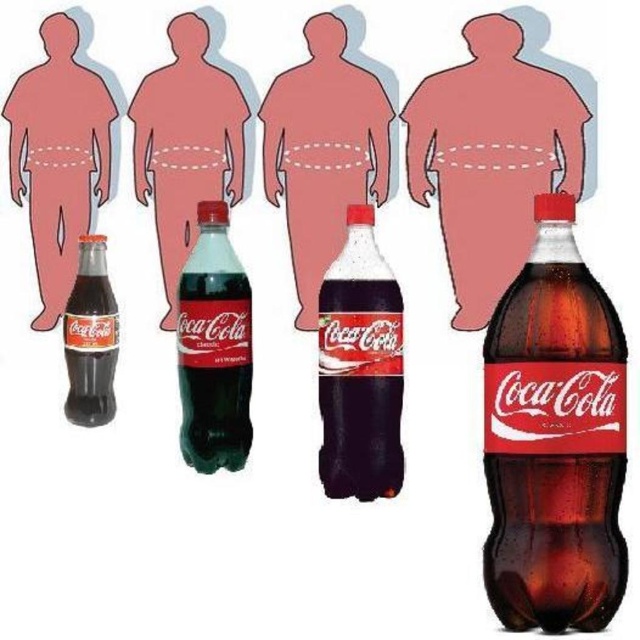
From the picture: You are a delivery person who needs to place the translucent plastic bottle at center and the matte glass bottle at lower left onto a shelf. However, the shelf has limited space. Which bottle should you place first to ensure both fit properly?

The translucent plastic bottle at center should be placed first since it is in front of the matte glass bottle at lower left, meaning it is closer to the viewer and should be positioned closer to the edge of the shelf to allow space for the matte glass bottle at lower left behind it.